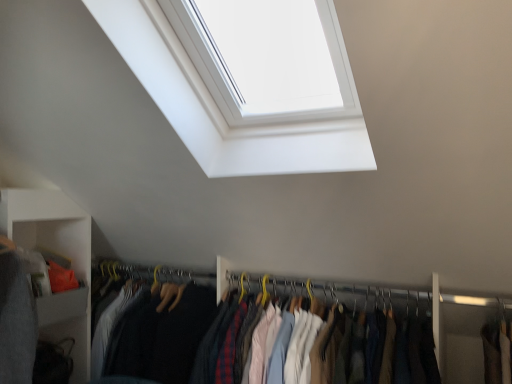
What do you see at coordinates (321, 335) in the screenshot?
I see `matte fabric clothes at center` at bounding box center [321, 335].

Where is `white matte shelf at lower left`? The height and width of the screenshot is (384, 512). white matte shelf at lower left is located at coordinates (56, 254).

I want to click on yellow metal hanger at center, so click(x=336, y=292).

You are a GUI agent. You are given a task and a screenshot of the screen. Output one action in this format:
    pyautogui.click(x=<x>, y=<y>)
    Task: Click on the matte fabric clothes at center
    
    Given the screenshot: What is the action you would take?
    pyautogui.click(x=321, y=335)

Does matte fabric clothes at center have a lesser width compared to white glossy window at upper center?

Indeed, matte fabric clothes at center has a lesser width compared to white glossy window at upper center.

Is point (165, 290) positioned after point (300, 148)?

Yes.

Can you confirm if matte fabric clothes at center is shorter than white glossy window at upper center?

Correct, matte fabric clothes at center is not as tall as white glossy window at upper center.

Is white matte shelf at lower left oriented towards matte gray cabinet at lower left?

Yes, white matte shelf at lower left is turned towards matte gray cabinet at lower left.

In the scene shown: Considering the relative positions of white matte shelf at lower left and matte gray cabinet at lower left in the image provided, is white matte shelf at lower left behind matte gray cabinet at lower left?

No, white matte shelf at lower left is closer to the viewer.

How far apart are white matte shelf at lower left and matte gray cabinet at lower left?

They are 2.29 inches apart.

From a real-world perspective, is white matte shelf at lower left physically located above or below matte gray cabinet at lower left?

white matte shelf at lower left is below matte gray cabinet at lower left.

In the image, is white glossy window at upper center positioned in front of or behind yellow metal hanger at center?

Visually, white glossy window at upper center is located in front of yellow metal hanger at center.

From the image's perspective, would you say white glossy window at upper center is positioned over yellow metal hanger at center?

Yes, from the image's perspective, white glossy window at upper center is on top of yellow metal hanger at center.

Is white glossy window at upper center wider or thinner than yellow metal hanger at center?

white glossy window at upper center is wider than yellow metal hanger at center.

From a real-world perspective, who is located lower, white glossy window at upper center or yellow metal hanger at center?

yellow metal hanger at center is physically lower.

Between point (63, 240) and point (246, 329), which one is positioned in front?

The point (246, 329) is closer to the camera.

The image size is (512, 384). I want to click on cabinet behind the matte fabric clothes at center, so click(x=58, y=239).

From the picture: Is matte gray cabinet at lower left thinner than matte fabric clothes at center?

Yes.

Does matte gray cabinet at lower left have a smaller size compared to matte fabric clothes at center?

Yes, matte gray cabinet at lower left is smaller than matte fabric clothes at center.

This screenshot has height=384, width=512. There is a white matte shelf at lower left. What are the coordinates of `cabinet above it (from a real-world perspective)` in the screenshot? It's located at (58, 239).

Between matte gray cabinet at lower left and white matte shelf at lower left, which one has larger size?

white matte shelf at lower left is bigger.

Which is closer to the camera, (63, 214) or (59, 329)?

The point (63, 214) is closer.

Is white matte shelf at lower left at the back of matte gray cabinet at lower left?

Yes, white matte shelf at lower left is at the back of matte gray cabinet at lower left.

Looking at this image, is the depth of white glossy window at upper center greater than that of white matte shelf at lower left?

No, the depth of white glossy window at upper center is less than that of white matte shelf at lower left.

Locate an element on the screen. The width and height of the screenshot is (512, 384). shelf located behind the white glossy window at upper center is located at coordinates (56, 254).

From the picture: How much distance is there between white glossy window at upper center and white matte shelf at lower left?

They are 37.96 inches apart.

From a real-world perspective, does white glossy window at upper center stand above white matte shelf at lower left?

Indeed, from a real-world perspective, white glossy window at upper center stands above white matte shelf at lower left.

Is matte fabric clothes at center directly adjacent to matte gray cabinet at lower left?

No, matte fabric clothes at center is not beside matte gray cabinet at lower left.

Is matte fabric clothes at center facing towards matte gray cabinet at lower left?

No.

Between matte fabric clothes at center and matte gray cabinet at lower left, which one appears on the left side from the viewer's perspective?

matte gray cabinet at lower left.

Considering the sizes of objects matte fabric clothes at center and matte gray cabinet at lower left in the image provided, who is bigger, matte fabric clothes at center or matte gray cabinet at lower left?

matte fabric clothes at center.

Where is `closet that appears on the right of white glossy window at upper center`? This screenshot has width=512, height=384. closet that appears on the right of white glossy window at upper center is located at coordinates point(321,335).

What are the coordinates of `cabinet behind the white matte shelf at lower left` in the screenshot? It's located at (58, 239).

Looking at the image, which one is located closer to white glossy window at upper center, matte fabric clothes at center or yellow metal hanger at center?

The object closer to white glossy window at upper center is matte fabric clothes at center.

When comparing their distances from yellow metal hanger at center, does white glossy window at upper center or matte fabric clothes at center seem closer?

matte fabric clothes at center is positioned closer to the anchor yellow metal hanger at center.

Based on their spatial positions, is matte fabric clothes at center or white glossy window at upper center further from matte gray cabinet at lower left?

white glossy window at upper center lies further to matte gray cabinet at lower left than the other object.

Considering their positions, is matte gray cabinet at lower left positioned further to white glossy window at upper center than matte fabric clothes at center?

matte gray cabinet at lower left.

Based on their spatial positions, is white matte shelf at lower left or yellow metal hanger at center further from matte fabric clothes at center?

Based on the image, white matte shelf at lower left appears to be further to matte fabric clothes at center.

Which object lies further to the anchor point white glossy window at upper center, yellow metal hanger at center or white matte shelf at lower left?

Based on the image, white matte shelf at lower left appears to be further to white glossy window at upper center.

From the picture: Which object lies further to the anchor point white matte shelf at lower left, matte fabric clothes at center or yellow metal hanger at center?

yellow metal hanger at center is further to white matte shelf at lower left.

Considering their positions, is white glossy window at upper center positioned further to matte gray cabinet at lower left than white matte shelf at lower left?

white glossy window at upper center is positioned further to the anchor matte gray cabinet at lower left.

Locate an element on the screen. Image resolution: width=512 pixels, height=384 pixels. cabinet between white matte shelf at lower left and matte fabric clothes at center in the horizontal direction is located at coordinates (58, 239).

This screenshot has width=512, height=384. In order to click on closet situated between white matte shelf at lower left and yellow metal hanger at center from left to right in this screenshot , I will do `click(321, 335)`.

You are a GUI agent. You are given a task and a screenshot of the screen. Output one action in this format:
    pyautogui.click(x=<x>, y=<y>)
    Task: Click on the window situated between white matte shelf at lower left and matte fabric clothes at center from left to right
    This screenshot has width=512, height=384.
    Given the screenshot: What is the action you would take?
    pyautogui.click(x=211, y=112)

The image size is (512, 384). Identify the location of hanger between white glossy window at upper center and matte fabric clothes at center from top to bottom. 336,292.